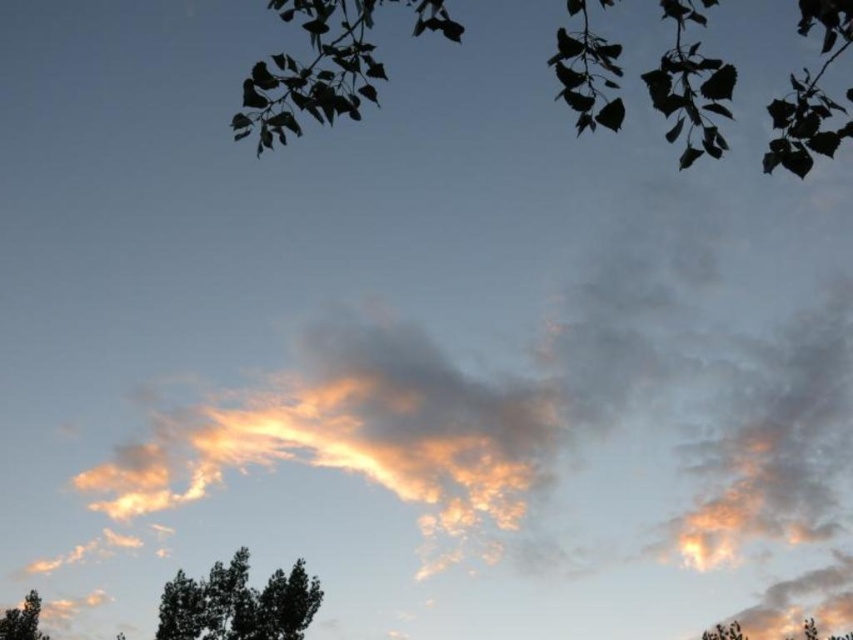
Can you confirm if silvery leaves at upper center is positioned below green leafy tree at lower left?

Actually, silvery leaves at upper center is above green leafy tree at lower left.

Which is behind, point (409, 10) or point (26, 618)?

Positioned behind is point (26, 618).

Identify the location of silvery leaves at upper center. (325, 65).

Can you confirm if black matte tree at lower left is thinner than green leafy tree at bottom right?

No, black matte tree at lower left is not thinner than green leafy tree at bottom right.

Can you confirm if black matte tree at lower left is positioned to the right of green leafy tree at bottom right?

No, black matte tree at lower left is not to the right of green leafy tree at bottom right.

Which is in front, point (199, 598) or point (711, 636)?

Positioned in front is point (711, 636).

The height and width of the screenshot is (640, 853). In order to click on black matte tree at lower left in this screenshot , I will do `click(238, 604)`.

Is silvery leaves at upper center wider than black matte tree at lower left?

No.

Is point (323, 96) less distant than point (233, 572)?

Yes, point (323, 96) is in front of point (233, 572).

The width and height of the screenshot is (853, 640). What are the coordinates of `silvery leaves at upper center` in the screenshot? It's located at (325, 65).